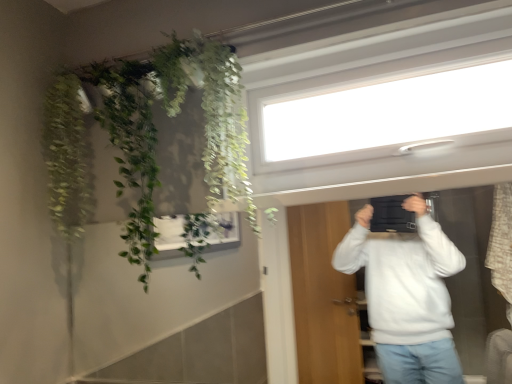
Question: From a real-world perspective, does transparent glass window at upper center stand above green leafy plant at upper left, the first plant viewed from the right?

Choices:
 (A) yes
 (B) no

Answer: (A)

Question: Is transparent glass window at upper center facing away from green leafy plant at upper left, the second plant when ordered from left to right?

Choices:
 (A) yes
 (B) no

Answer: (B)

Question: Considering the relative sizes of transparent glass window at upper center and green leafy plant at upper left, the second plant when ordered from left to right, in the image provided, is transparent glass window at upper center shorter than green leafy plant at upper left, the second plant when ordered from left to right,?

Choices:
 (A) no
 (B) yes

Answer: (B)

Question: From the image's perspective, would you say transparent glass window at upper center is shown under green leafy plant at upper left, the first plant viewed from the right?

Choices:
 (A) no
 (B) yes

Answer: (A)

Question: Is transparent glass window at upper center placed right next to green leafy plant at upper left, the second plant when ordered from left to right?

Choices:
 (A) no
 (B) yes

Answer: (A)

Question: In terms of height, does green leafy plant at upper left, the second plant when ordered from left to right, look taller or shorter compared to green leafy plant at upper left, acting as the second plant starting from the right?

Choices:
 (A) tall
 (B) short

Answer: (A)

Question: From a real-world perspective, is green leafy plant at upper left, the second plant when ordered from left to right, positioned above or below green leafy plant at upper left, which appears as the first plant when viewed from the left?

Choices:
 (A) below
 (B) above

Answer: (A)

Question: Visually, is green leafy plant at upper left, the second plant when ordered from left to right, positioned to the left or to the right of green leafy plant at upper left, acting as the second plant starting from the right?

Choices:
 (A) right
 (B) left

Answer: (A)

Question: Do you think green leafy plant at upper left, the first plant viewed from the right, is within green leafy plant at upper left, acting as the second plant starting from the right, or outside of it?

Choices:
 (A) outside
 (B) inside

Answer: (A)

Question: Which is correct: green leafy plant at upper left, which appears as the first plant when viewed from the left, is inside green leafy plant at upper left, the first plant viewed from the right, or outside of it?

Choices:
 (A) outside
 (B) inside

Answer: (A)

Question: Relative to green leafy plant at upper left, the second plant when ordered from left to right, is green leafy plant at upper left, which appears as the first plant when viewed from the left, in front or behind?

Choices:
 (A) front
 (B) behind

Answer: (B)

Question: From a real-world perspective, relative to green leafy plant at upper left, the second plant when ordered from left to right, is green leafy plant at upper left, acting as the second plant starting from the right, vertically above or below?

Choices:
 (A) below
 (B) above

Answer: (B)

Question: Based on their positions, is green leafy plant at upper left, which appears as the first plant when viewed from the left, located to the left or right of green leafy plant at upper left, the first plant viewed from the right?

Choices:
 (A) left
 (B) right

Answer: (A)

Question: From the image's perspective, is green leafy plant at upper left, which appears as the first plant when viewed from the left, above or below transparent glass window at upper center?

Choices:
 (A) above
 (B) below

Answer: (B)

Question: Is point (76, 175) positioned closer to the camera than point (434, 107)?

Choices:
 (A) farther
 (B) closer

Answer: (A)